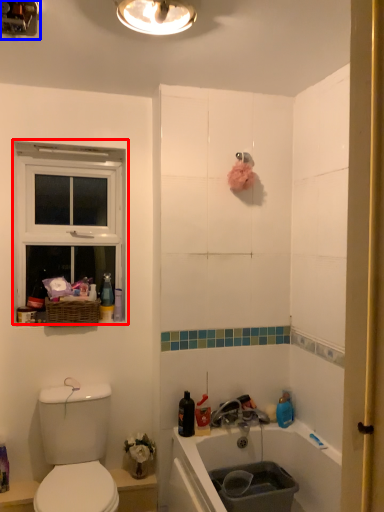
Question: Which object appears farthest to the camera in this image, window (highlighted by a red box) or light fixture (highlighted by a blue box)?

Choices:
 (A) window
 (B) light fixture

Answer: (A)